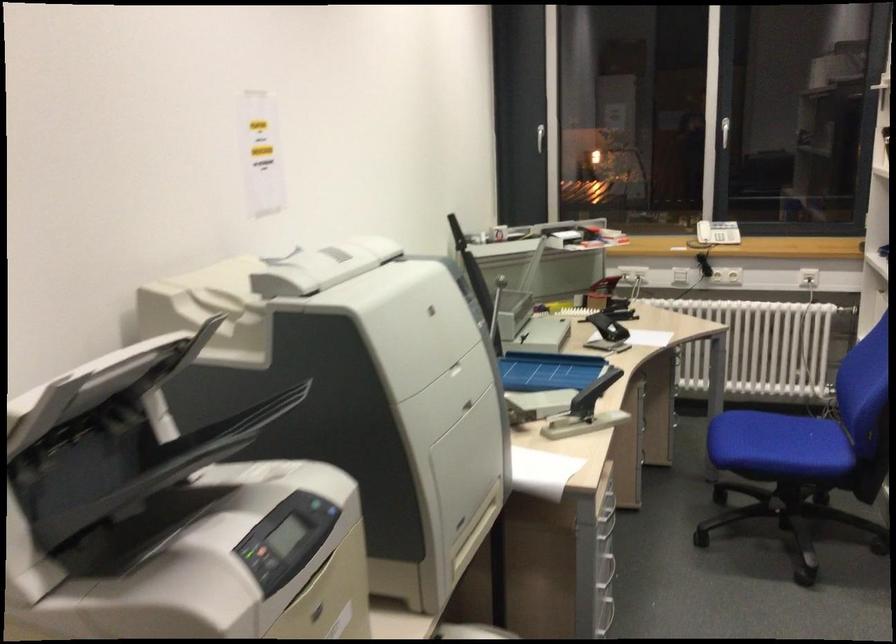
The width and height of the screenshot is (896, 644). Identify the location of chair armrest. (867, 469).